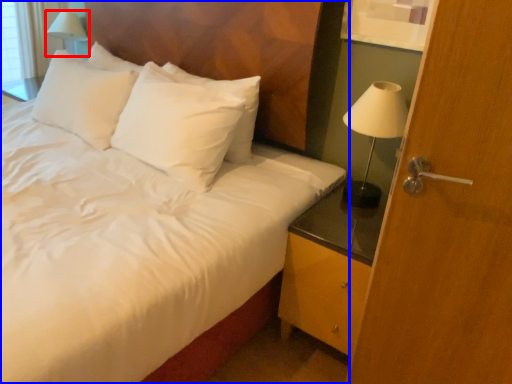
Question: Which object is closer to the camera taking this photo, table lamp (highlighted by a red box) or bed (highlighted by a blue box)?

Choices:
 (A) table lamp
 (B) bed

Answer: (B)